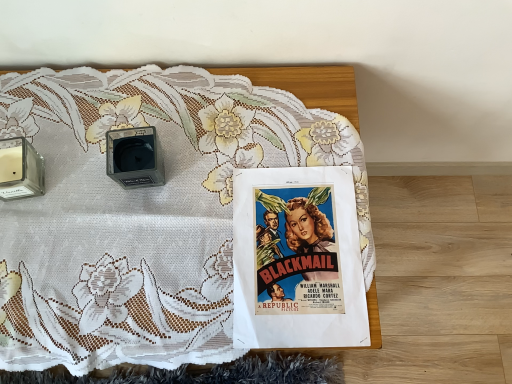
Question: Is point (154, 160) closer or farther from the camera than point (40, 173)?

Choices:
 (A) farther
 (B) closer

Answer: (B)

Question: Is matte black speaker at center, positioned as the 2th speaker in left-to-right order, taller or shorter than transparent glass candle at left, acting as the first speaker starting from the left?

Choices:
 (A) tall
 (B) short

Answer: (A)

Question: Which object is the closest to the matte paper poster at center?

Choices:
 (A) matte black speaker at center, placed as the 1th speaker when sorted from right to left
 (B) white lace tablecloth at upper center
 (C) transparent glass candle at left, positioned as the 2th speaker in right-to-left order

Answer: (B)

Question: Estimate the real-world distances between objects in this image. Which object is farther from the matte paper poster at center?

Choices:
 (A) transparent glass candle at left, positioned as the 2th speaker in right-to-left order
 (B) white lace tablecloth at upper center
 (C) matte black speaker at center, placed as the 1th speaker when sorted from right to left

Answer: (A)